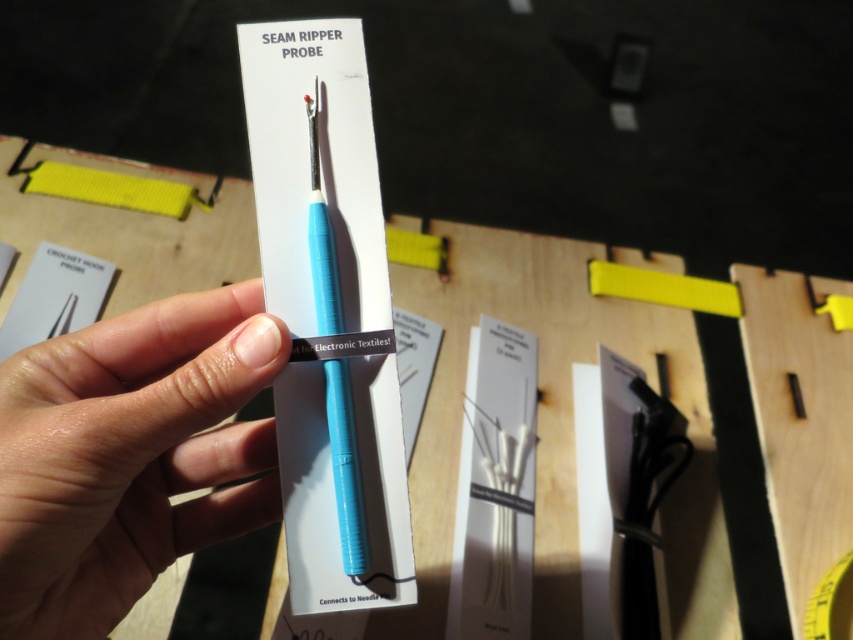
Between light skin tone flesh at center and blue plastic seam ripper probe at center, which one is positioned higher?

blue plastic seam ripper probe at center is above.

Between point (165, 518) and point (318, 291), which one is positioned in front?

Positioned in front is point (318, 291).

Between point (96, 620) and point (358, 464), which one is positioned behind?

The point (358, 464) is more distant.

Image resolution: width=853 pixels, height=640 pixels. Identify the location of light skin tone flesh at center. (131, 454).

Which is more to the left, light skin tone flesh at center or yellow matte tape measure at center?

From the viewer's perspective, light skin tone flesh at center appears more on the left side.

Between light skin tone flesh at center and yellow matte tape measure at center, which one has less height?

yellow matte tape measure at center is shorter.

Is point (83, 576) closer to viewer compared to point (804, 636)?

Yes, it is in front of point (804, 636).

Where is `light skin tone flesh at center`? light skin tone flesh at center is located at coordinates (131, 454).

Can you confirm if blue plastic seam ripper probe at center is wider than yellow matte tape measure at center?

In fact, blue plastic seam ripper probe at center might be narrower than yellow matte tape measure at center.

Can you confirm if blue plastic seam ripper probe at center is positioned below yellow matte tape measure at center?

No, blue plastic seam ripper probe at center is not below yellow matte tape measure at center.

Locate an element on the screen. Image resolution: width=853 pixels, height=640 pixels. blue plastic seam ripper probe at center is located at coordinates (345, 467).

This screenshot has height=640, width=853. Find the location of `blue plastic seam ripper probe at center`. blue plastic seam ripper probe at center is located at coordinates point(345,467).